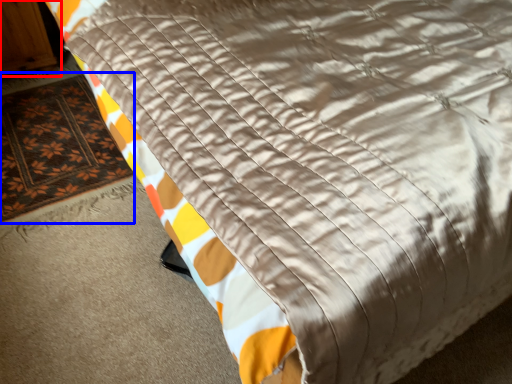
Question: Which of the following is the closest to the observer, armoire (highlighted by a red box) or mat (highlighted by a blue box)?

Choices:
 (A) armoire
 (B) mat

Answer: (B)